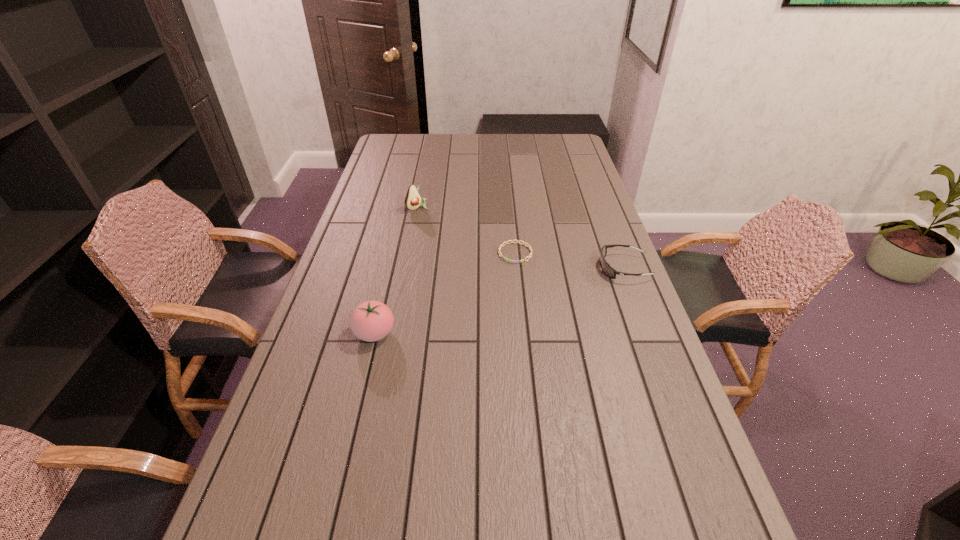
This screenshot has height=540, width=960. In order to click on vacant space positioned on the surface of the third object from left to right showing star-shaped elements in this screenshot , I will do `click(502, 279)`.

I want to click on vacant space positioned on the surface of the third object from left to right showing star-shaped elements, so click(496, 289).

Find the location of a particular element. vacant space located on the surface of the third object from left to right showing star-shaped elements is located at coordinates (467, 347).

The width and height of the screenshot is (960, 540). What are the coordinates of `vacant space located 0.290m on the seed side of the farthest object` in the screenshot? It's located at 473,249.

Where is `free space located 0.220m on the seed side of the farthest object`? The height and width of the screenshot is (540, 960). free space located 0.220m on the seed side of the farthest object is located at coordinates (460, 240).

I want to click on free space located 0.260m on the seed side of the farthest object, so click(468, 245).

You are a GUI agent. You are given a task and a screenshot of the screen. Output one action in this format:
    pyautogui.click(x=<x>, y=<y>)
    Task: Click on the object that is at the left edge
    This screenshot has width=960, height=540.
    Given the screenshot: What is the action you would take?
    pyautogui.click(x=371, y=321)

Locate an element on the screen. object present at the right edge is located at coordinates (605, 266).

The image size is (960, 540). What are the coordinates of `free space at the far edge of the desktop` in the screenshot? It's located at (526, 152).

Locate an element on the screen. The width and height of the screenshot is (960, 540). vacant space at the left edge of the desktop is located at coordinates (329, 293).